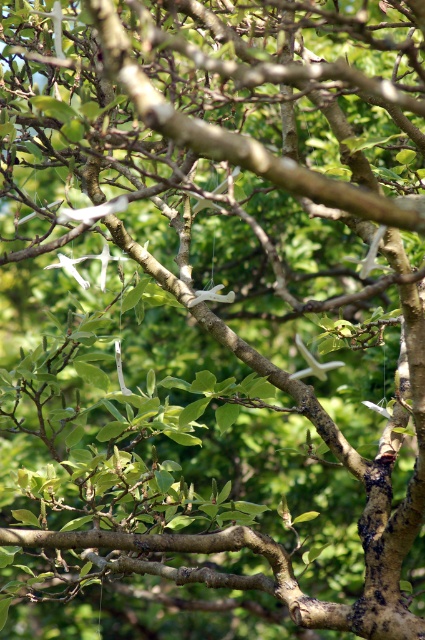
You are looking at the tree branches with two white star decorations. The first star is at point (110, 209) and the second is at point (314, 368). Which star appears closer to you?

Point (110, 209) is closer to the viewer than point (314, 368), so the first star appears closer.

You are a birdwatcher observing the tree branches. You notice two white matte birds in the scene. Which one is closer to you, the white matte bird at upper center or the white matte bird at center?

The white matte bird at upper center is closer to you because it is in front of the white matte bird at center.